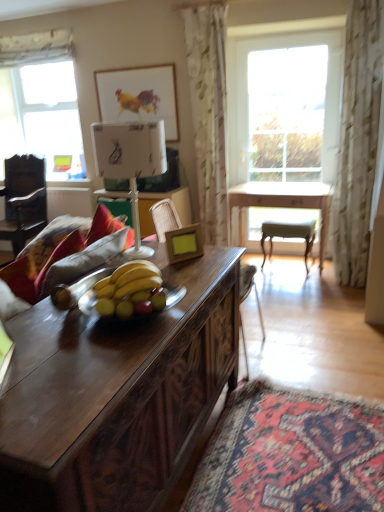
I want to click on free space above watercolor paper picture frame at upper center, marked as the 1th picture frame in a back-to-front arrangement (from a real-world perspective), so click(150, 57).